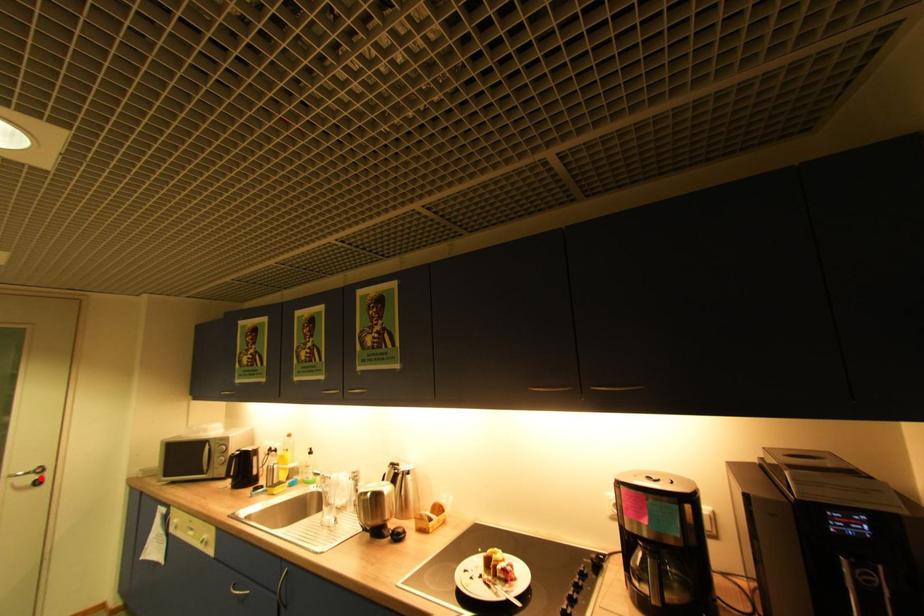
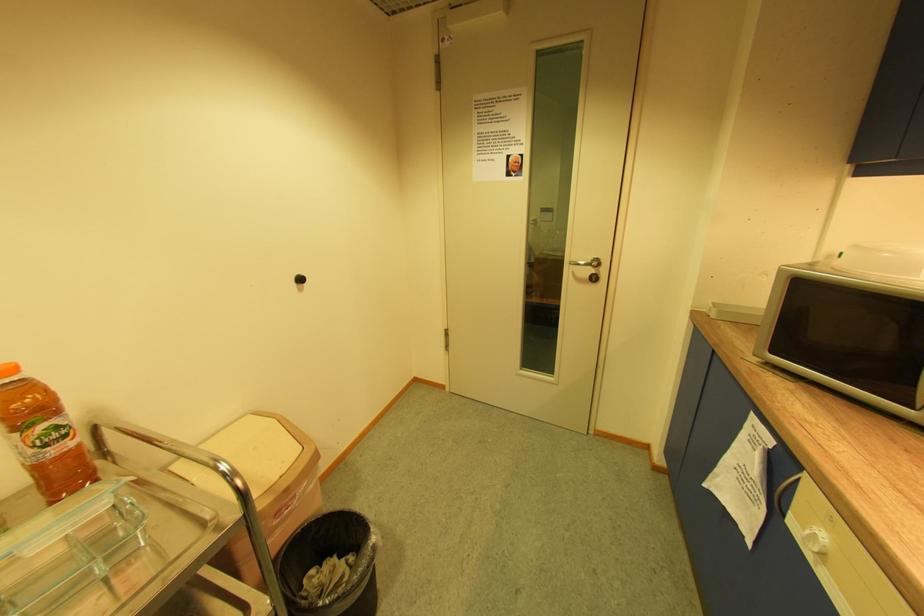
Question: I am providing you with two images of the same scene from different viewpoints. In image1, a red point is highlighted. Considering the same 3D point in image2, which of the following is correct?

Choices:
 (A) It is closer
 (B) It is farther

Answer: (B)